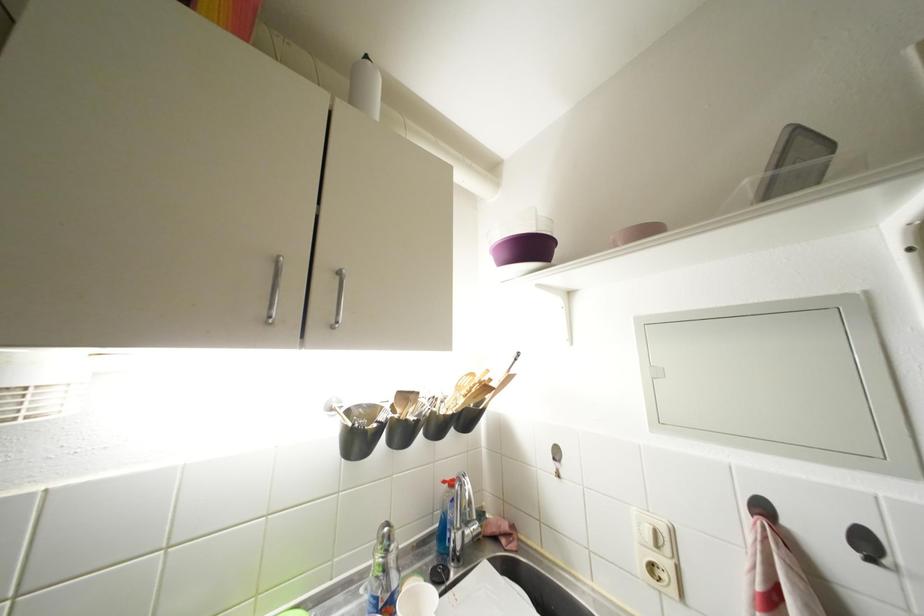
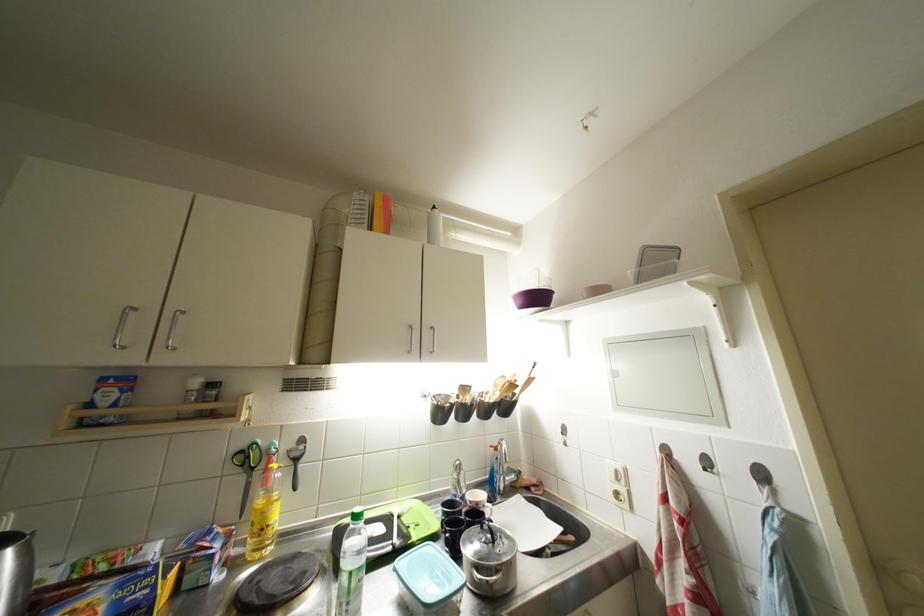
Locate, in the second image, the point that corresponds to point 492,392 in the first image.

(519, 390)